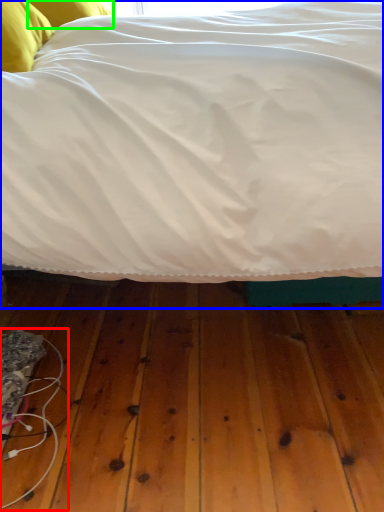
Question: Considering the real-world distances, which object is closest to wire (highlighted by a red box)? bed (highlighted by a blue box) or pillow (highlighted by a green box).

Choices:
 (A) bed
 (B) pillow

Answer: (A)